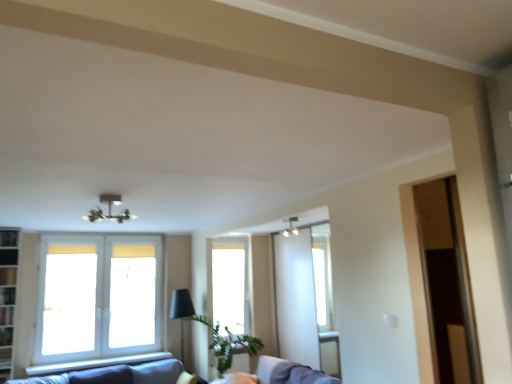
Question: Can you confirm if metallic chandelier at upper center is thinner than white glass window at left, which is counted as the 2th window, starting from the right?

Choices:
 (A) no
 (B) yes

Answer: (A)

Question: Can you confirm if metallic chandelier at upper center is shorter than white glass window at left, which is the 1th window from front to back?

Choices:
 (A) yes
 (B) no

Answer: (A)

Question: From a real-world perspective, is metallic chandelier at upper center physically above white glass window at left, which ranks as the second window in back-to-front order?

Choices:
 (A) yes
 (B) no

Answer: (A)

Question: Can white glass window at left, which is counted as the 2th window, starting from the right, be found inside metallic chandelier at upper center?

Choices:
 (A) no
 (B) yes

Answer: (A)

Question: Is metallic chandelier at upper center further to the viewer compared to white glass window at left, which is counted as the 2th window, starting from the right?

Choices:
 (A) yes
 (B) no

Answer: (B)

Question: Looking at the image, does metallic chandelier at upper center seem bigger or smaller compared to transparent glass window at center, the second window from the front?

Choices:
 (A) big
 (B) small

Answer: (B)

Question: From their relative heights in the image, would you say metallic chandelier at upper center is taller or shorter than transparent glass window at center, the second window from the front?

Choices:
 (A) short
 (B) tall

Answer: (A)

Question: From the image's perspective, relative to transparent glass window at center, acting as the 1th window starting from the back, is metallic chandelier at upper center above or below?

Choices:
 (A) above
 (B) below

Answer: (A)

Question: Choose the correct answer: Is metallic chandelier at upper center inside transparent glass window at center, placed as the second window when sorted from left to right, or outside it?

Choices:
 (A) inside
 (B) outside

Answer: (B)

Question: Considering the positions of dark gray fabric couch at lower left and metallic chandelier at upper center in the image, is dark gray fabric couch at lower left wider or thinner than metallic chandelier at upper center?

Choices:
 (A) wide
 (B) thin

Answer: (A)

Question: Visually, is dark gray fabric couch at lower left positioned to the left or to the right of metallic chandelier at upper center?

Choices:
 (A) left
 (B) right

Answer: (A)

Question: From the image's perspective, is dark gray fabric couch at lower left above or below metallic chandelier at upper center?

Choices:
 (A) below
 (B) above

Answer: (A)

Question: From a real-world perspective, relative to metallic chandelier at upper center, is dark gray fabric couch at lower left vertically above or below?

Choices:
 (A) above
 (B) below

Answer: (B)

Question: In terms of height, does metallic chandelier at upper center look taller or shorter compared to white glass window at left, which is counted as the 2th window, starting from the right?

Choices:
 (A) tall
 (B) short

Answer: (B)

Question: Considering their positions, is metallic chandelier at upper center located in front of or behind white glass window at left, which is counted as the 2th window, starting from the right?

Choices:
 (A) front
 (B) behind

Answer: (A)